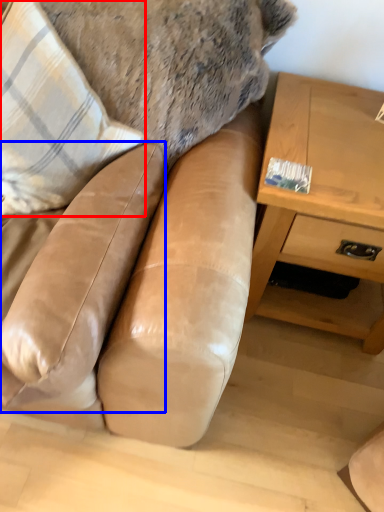
Question: Among these objects, which one is nearest to the camera, throw pillow (highlighted by a red box) or swivel chair (highlighted by a blue box)?

Choices:
 (A) throw pillow
 (B) swivel chair

Answer: (B)